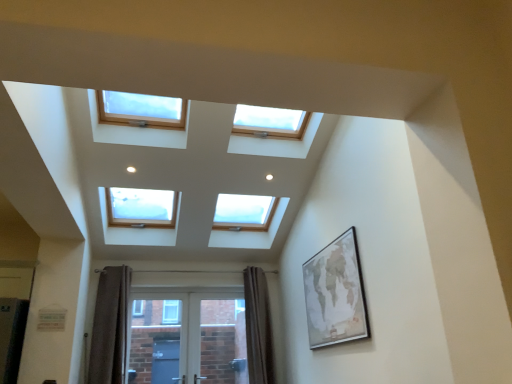
What do you see at coordinates (258, 327) in the screenshot?
I see `brown textured curtain at lower center, marked as the 2th curtain in a left-to-right arrangement` at bounding box center [258, 327].

Where is `white glossy screen door at lower center`? white glossy screen door at lower center is located at coordinates (188, 338).

Choose the correct answer: Is brown textured curtain at lower center, marked as the 2th curtain in a left-to-right arrangement, inside white glossy screen door at lower center or outside it?

brown textured curtain at lower center, marked as the 2th curtain in a left-to-right arrangement, is not inside white glossy screen door at lower center, it's outside.

From a real-world perspective, is brown textured curtain at lower center, marked as the 2th curtain in a left-to-right arrangement, on white glossy screen door at lower center?

Indeed, from a real-world perspective, brown textured curtain at lower center, marked as the 2th curtain in a left-to-right arrangement, stands above white glossy screen door at lower center.

From the image's perspective, relative to white glossy screen door at lower center, is brown textured curtain at lower center, which ranks as the first curtain in right-to-left order, above or below?

Clearly, from the image's perspective, brown textured curtain at lower center, which ranks as the first curtain in right-to-left order, is above white glossy screen door at lower center.

Is brown velvet curtain at lower left, marked as the 2th curtain in a right-to-left arrangement, oriented towards wooden-framed map at right?

No, brown velvet curtain at lower left, marked as the 2th curtain in a right-to-left arrangement, is not aimed at wooden-framed map at right.

Is point (121, 338) closer or farther from the camera than point (352, 293)?

Point (121, 338) appears to be farther away from the viewer than point (352, 293).

Is brown velvet curtain at lower left, marked as the 2th curtain in a right-to-left arrangement, to the left of wooden-framed map at right from the viewer's perspective?

Yes, brown velvet curtain at lower left, marked as the 2th curtain in a right-to-left arrangement, is to the left of wooden-framed map at right.

Is brown velvet curtain at lower left, acting as the 1th curtain starting from the left, not near wooden-framed map at right?

Indeed, brown velvet curtain at lower left, acting as the 1th curtain starting from the left, is not near wooden-framed map at right.

How different are the orientations of wooden-framed map at right and brown textured curtain at lower center, marked as the 2th curtain in a left-to-right arrangement, in degrees?

wooden-framed map at right and brown textured curtain at lower center, marked as the 2th curtain in a left-to-right arrangement, are facing 89.7 degrees away from each other.

How far apart are wooden-framed map at right and brown textured curtain at lower center, marked as the 2th curtain in a left-to-right arrangement?

A distance of 4.94 feet exists between wooden-framed map at right and brown textured curtain at lower center, marked as the 2th curtain in a left-to-right arrangement.

Is wooden-framed map at right taller or shorter than brown textured curtain at lower center, marked as the 2th curtain in a left-to-right arrangement?

Clearly, wooden-framed map at right is shorter compared to brown textured curtain at lower center, marked as the 2th curtain in a left-to-right arrangement.

Based on the photo, is wooden-framed map at right wider or thinner than brown textured curtain at lower center, which ranks as the first curtain in right-to-left order?

In the image, wooden-framed map at right appears to be more narrow than brown textured curtain at lower center, which ranks as the first curtain in right-to-left order.

Would you say white glossy screen door at lower center is part of wooden-framed map at right's contents?

No, white glossy screen door at lower center is not inside wooden-framed map at right.

Considering the relative sizes of wooden-framed map at right and white glossy screen door at lower center in the image provided, is wooden-framed map at right smaller than white glossy screen door at lower center?

Correct, wooden-framed map at right occupies less space than white glossy screen door at lower center.

Does wooden-framed map at right turn towards white glossy screen door at lower center?

No, wooden-framed map at right is not oriented towards white glossy screen door at lower center.

Is brown velvet curtain at lower left, marked as the 2th curtain in a right-to-left arrangement, oriented away from white glossy screen door at lower center?

That's not correct — brown velvet curtain at lower left, marked as the 2th curtain in a right-to-left arrangement, is not looking away from white glossy screen door at lower center.

Considering their positions, is brown velvet curtain at lower left, acting as the 1th curtain starting from the left, located in front of or behind white glossy screen door at lower center?

Clearly, brown velvet curtain at lower left, acting as the 1th curtain starting from the left, is in front of white glossy screen door at lower center.

From a real-world perspective, is brown velvet curtain at lower left, acting as the 1th curtain starting from the left, positioned above or below white glossy screen door at lower center?

brown velvet curtain at lower left, acting as the 1th curtain starting from the left, is above white glossy screen door at lower center.

Which is less distant, (104, 313) or (204, 318)?

The point (104, 313) is closer.

Choose the correct answer: Is brown textured curtain at lower center, marked as the 2th curtain in a left-to-right arrangement, inside brown velvet curtain at lower left, marked as the 2th curtain in a right-to-left arrangement, or outside it?

brown textured curtain at lower center, marked as the 2th curtain in a left-to-right arrangement, is not enclosed by brown velvet curtain at lower left, marked as the 2th curtain in a right-to-left arrangement.

From the picture: Considering the sizes of objects brown textured curtain at lower center, marked as the 2th curtain in a left-to-right arrangement, and brown velvet curtain at lower left, marked as the 2th curtain in a right-to-left arrangement, in the image provided, who is smaller, brown textured curtain at lower center, marked as the 2th curtain in a left-to-right arrangement, or brown velvet curtain at lower left, marked as the 2th curtain in a right-to-left arrangement,?

Smaller between the two is brown velvet curtain at lower left, marked as the 2th curtain in a right-to-left arrangement.

From a real-world perspective, who is located higher, brown textured curtain at lower center, which ranks as the first curtain in right-to-left order, or brown velvet curtain at lower left, marked as the 2th curtain in a right-to-left arrangement?

brown velvet curtain at lower left, marked as the 2th curtain in a right-to-left arrangement.

Does brown textured curtain at lower center, marked as the 2th curtain in a left-to-right arrangement, lie in front of brown velvet curtain at lower left, marked as the 2th curtain in a right-to-left arrangement?

No, brown textured curtain at lower center, marked as the 2th curtain in a left-to-right arrangement, is further to the viewer.

Based on their sizes in the image, would you say wooden-framed map at right is bigger or smaller than brown velvet curtain at lower left, marked as the 2th curtain in a right-to-left arrangement?

Clearly, wooden-framed map at right is smaller in size than brown velvet curtain at lower left, marked as the 2th curtain in a right-to-left arrangement.

Is wooden-framed map at right aimed at brown velvet curtain at lower left, acting as the 1th curtain starting from the left?

No.

From the image's perspective, is wooden-framed map at right beneath brown velvet curtain at lower left, acting as the 1th curtain starting from the left?

No, from the image's perspective, wooden-framed map at right is not below brown velvet curtain at lower left, acting as the 1th curtain starting from the left.

This screenshot has height=384, width=512. Identify the location of screen door that appears behind the brown textured curtain at lower center, which ranks as the first curtain in right-to-left order. pyautogui.click(x=188, y=338).

From a real-world perspective, which curtain is the 1st one underneath the wooden-framed map at right? Please provide its 2D coordinates.

[(110, 327)]

From the image, which object appears to be nearer to brown textured curtain at lower center, marked as the 2th curtain in a left-to-right arrangement, white glossy screen door at lower center or brown velvet curtain at lower left, marked as the 2th curtain in a right-to-left arrangement?

white glossy screen door at lower center.

Estimate the real-world distances between objects in this image. Which object is further from brown textured curtain at lower center, which ranks as the first curtain in right-to-left order, white glossy screen door at lower center or wooden-framed map at right?

wooden-framed map at right is further to brown textured curtain at lower center, which ranks as the first curtain in right-to-left order.

Based on their spatial positions, is white glossy screen door at lower center or wooden-framed map at right further from brown velvet curtain at lower left, acting as the 1th curtain starting from the left?

wooden-framed map at right is further to brown velvet curtain at lower left, acting as the 1th curtain starting from the left.

Based on their spatial positions, is white glossy screen door at lower center or brown velvet curtain at lower left, marked as the 2th curtain in a right-to-left arrangement, further from wooden-framed map at right?

brown velvet curtain at lower left, marked as the 2th curtain in a right-to-left arrangement.

Considering their positions, is wooden-framed map at right positioned closer to white glossy screen door at lower center than brown velvet curtain at lower left, marked as the 2th curtain in a right-to-left arrangement?

Among the two, brown velvet curtain at lower left, marked as the 2th curtain in a right-to-left arrangement, is located nearer to white glossy screen door at lower center.

Which object lies further to the anchor point wooden-framed map at right, brown velvet curtain at lower left, acting as the 1th curtain starting from the left, or white glossy screen door at lower center?

brown velvet curtain at lower left, acting as the 1th curtain starting from the left, is further to wooden-framed map at right.

Based on the photo, from the image, which object appears to be farther from brown textured curtain at lower center, marked as the 2th curtain in a left-to-right arrangement, wooden-framed map at right or brown velvet curtain at lower left, acting as the 1th curtain starting from the left?

Among the two, wooden-framed map at right is located further to brown textured curtain at lower center, marked as the 2th curtain in a left-to-right arrangement.

From the image, which object appears to be nearer to wooden-framed map at right, white glossy screen door at lower center or brown textured curtain at lower center, which ranks as the first curtain in right-to-left order?

The object closer to wooden-framed map at right is brown textured curtain at lower center, which ranks as the first curtain in right-to-left order.

Locate an element on the screen. The image size is (512, 384). screen door located between brown velvet curtain at lower left, acting as the 1th curtain starting from the left, and wooden-framed map at right in the left-right direction is located at coordinates (188, 338).

The image size is (512, 384). In order to click on screen door situated between brown velvet curtain at lower left, acting as the 1th curtain starting from the left, and brown textured curtain at lower center, marked as the 2th curtain in a left-to-right arrangement, from left to right in this screenshot , I will do `click(188, 338)`.

You are a GUI agent. You are given a task and a screenshot of the screen. Output one action in this format:
    pyautogui.click(x=<x>, y=<y>)
    Task: Click on the curtain between brown velvet curtain at lower left, marked as the 2th curtain in a right-to-left arrangement, and wooden-framed map at right
    The height and width of the screenshot is (384, 512).
    Given the screenshot: What is the action you would take?
    pyautogui.click(x=258, y=327)